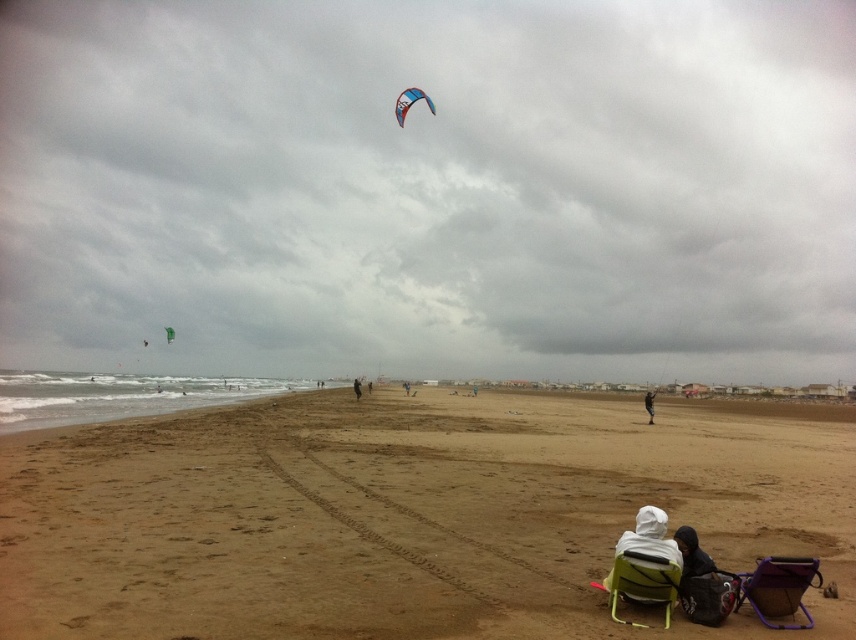
Question: Is blue glossy kite at upper center wider than green fabric kite at upper center?

Choices:
 (A) no
 (B) yes

Answer: (B)

Question: Which point appears farthest from the camera in this image?

Choices:
 (A) (415, 100)
 (B) (663, 532)
 (C) (407, 387)
 (D) (449, 481)

Answer: (C)

Question: Which point is closer to the camera?

Choices:
 (A) (165, 333)
 (B) (402, 385)
 (C) (418, 97)

Answer: (C)

Question: Which of the following is the farthest from the observer?

Choices:
 (A) (173, 330)
 (B) (759, 563)
 (C) (658, 586)

Answer: (A)

Question: Is green plastic beach chair at lower right thinner than green fabric kite at upper left?

Choices:
 (A) yes
 (B) no

Answer: (A)

Question: Does cloudy sky at upper center appear over blue glossy kite at upper center?

Choices:
 (A) yes
 (B) no

Answer: (A)